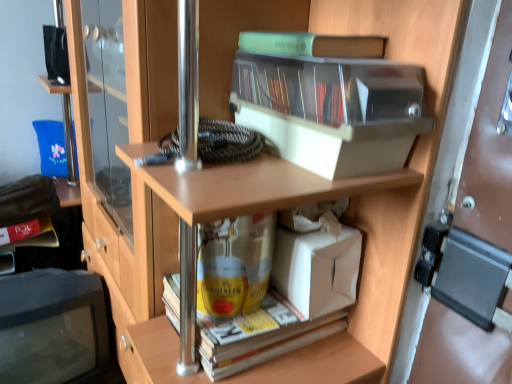
Question: Is matte yellow book at lower left, positioned as the 3th book in right-to-left order, thinner than transparent plastic storage box at upper center?

Choices:
 (A) yes
 (B) no

Answer: (A)

Question: Is there a large distance between matte yellow book at lower left, the third book from the front, and transparent plastic storage box at upper center?

Choices:
 (A) no
 (B) yes

Answer: (B)

Question: Does matte yellow book at lower left, the first book viewed from the left, come in front of transparent plastic storage box at upper center?

Choices:
 (A) no
 (B) yes

Answer: (A)

Question: From a real-world perspective, is matte yellow book at lower left, the first book viewed from the left, below transparent plastic storage box at upper center?

Choices:
 (A) no
 (B) yes

Answer: (B)

Question: Can transparent plastic storage box at upper center be found inside matte yellow book at lower left, the 2th book in the bottom-to-top sequence?

Choices:
 (A) yes
 (B) no

Answer: (B)

Question: Relative to yellow paperback book at lower center, placed as the second book when sorted from right to left, is white cardboard box at lower center in front or behind?

Choices:
 (A) front
 (B) behind

Answer: (B)

Question: Is point (288, 289) positioned closer to the camera than point (229, 352)?

Choices:
 (A) farther
 (B) closer

Answer: (A)

Question: Is white cardboard box at lower center spatially inside yellow paperback book at lower center, which is the 3th book in top-to-bottom order, or outside of it?

Choices:
 (A) inside
 (B) outside

Answer: (B)

Question: In terms of height, does white cardboard box at lower center look taller or shorter compared to yellow paperback book at lower center, the 2th book positioned from the left?

Choices:
 (A) tall
 (B) short

Answer: (A)

Question: Looking at their shapes, would you say matte black monitor at lower left is wider or thinner than yellow paperback book at lower center, which is the first book from bottom to top?

Choices:
 (A) thin
 (B) wide

Answer: (B)

Question: Based on their sizes in the image, would you say matte black monitor at lower left is bigger or smaller than yellow paperback book at lower center, the 2th book positioned from the left?

Choices:
 (A) small
 (B) big

Answer: (B)

Question: Visually, is matte black monitor at lower left positioned to the left or to the right of yellow paperback book at lower center, placed as the second book when sorted from right to left?

Choices:
 (A) right
 (B) left

Answer: (B)

Question: From a real-world perspective, is matte black monitor at lower left above or below yellow paperback book at lower center, the 2th book positioned from the left?

Choices:
 (A) below
 (B) above

Answer: (A)

Question: Considering the positions of matte yellow book at lower left, positioned as the 3th book in right-to-left order, and green plastic book at upper center, acting as the 3th book starting from the bottom, in the image, is matte yellow book at lower left, positioned as the 3th book in right-to-left order, taller or shorter than green plastic book at upper center, acting as the 3th book starting from the bottom,?

Choices:
 (A) short
 (B) tall

Answer: (B)

Question: Is matte yellow book at lower left, positioned as the 3th book in right-to-left order, bigger or smaller than green plastic book at upper center, the 1th book viewed from the front?

Choices:
 (A) small
 (B) big

Answer: (B)